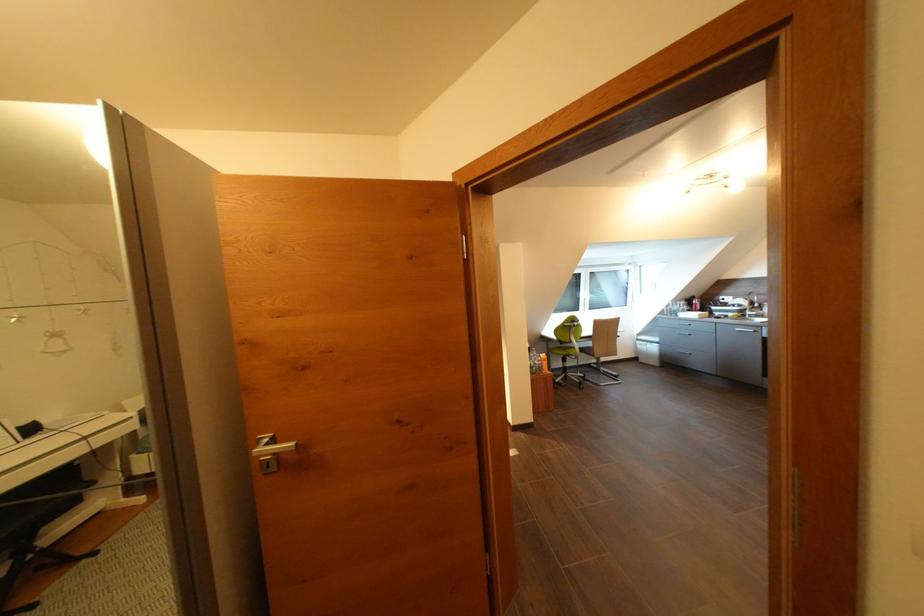
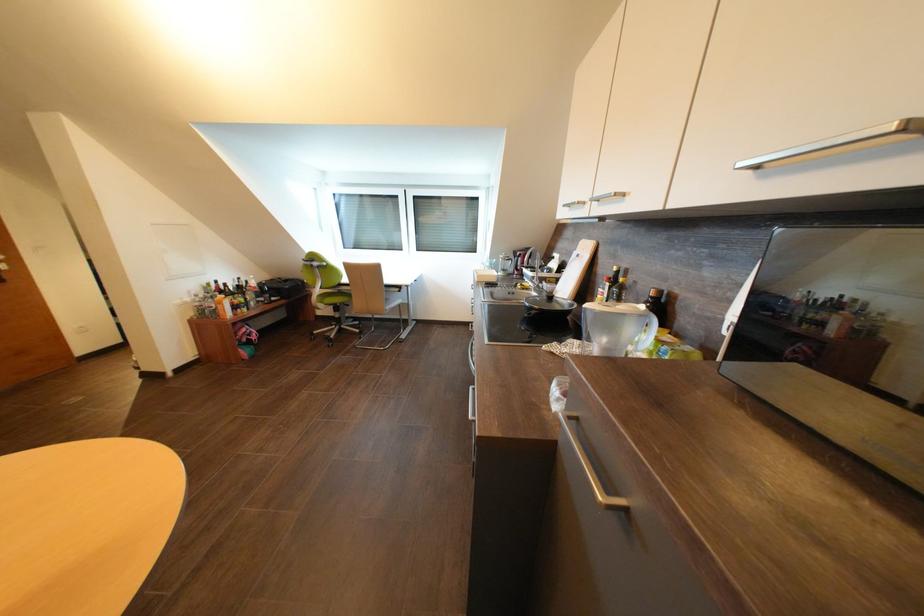
In a continuous first-person perspective shot, in which direction is the camera moving?

The cameraman moved toward right, forward.